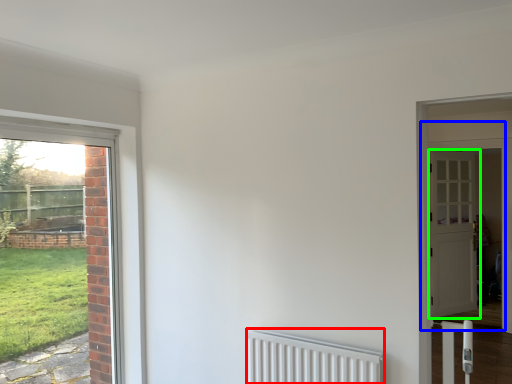
Question: Estimate the real-world distances between objects in this image. Which object is closer to radiator (highlighted by a red box), door (highlighted by a blue box) or door (highlighted by a green box)?

Choices:
 (A) door
 (B) door

Answer: (A)